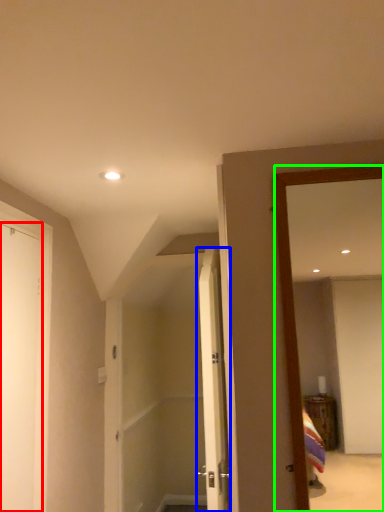
Question: Which object is positioned closest to door (highlighted by a red box)? Select from door (highlighted by a blue box) and mirror (highlighted by a green box).

Choices:
 (A) door
 (B) mirror

Answer: (A)